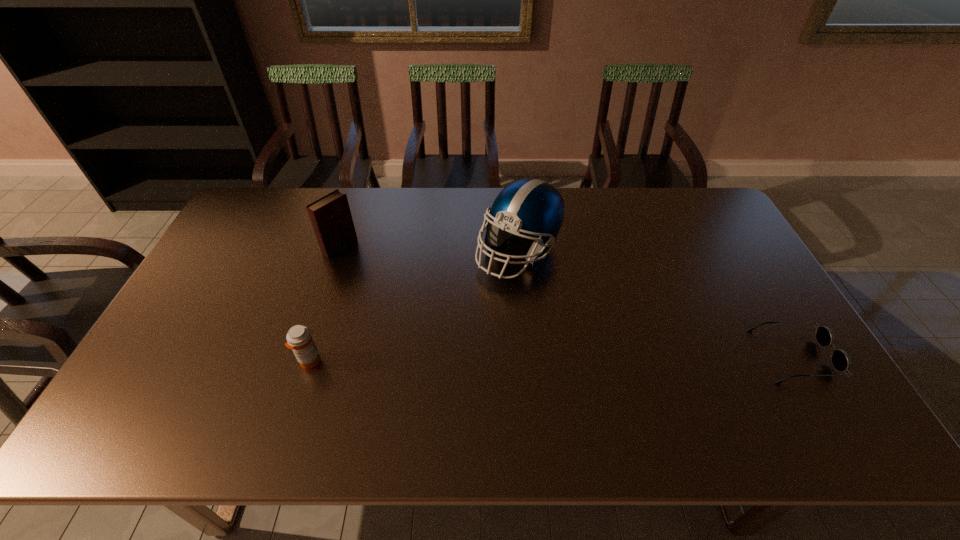
Where is `the second shortest object`? the second shortest object is located at coordinates (299, 339).

The image size is (960, 540). I want to click on the rightmost object, so click(840, 360).

Locate an element on the screen. The image size is (960, 540). sunglasses is located at coordinates (840, 360).

Identify the location of the tallest object. (532, 207).

This screenshot has height=540, width=960. Identify the location of football helmet. (532, 207).

Locate an element on the screen. The height and width of the screenshot is (540, 960). the third shortest object is located at coordinates (330, 216).

Image resolution: width=960 pixels, height=540 pixels. What are the coordinates of `free location located 0.140m on the right of the medicine` in the screenshot? It's located at (375, 361).

Locate an element on the screen. The image size is (960, 540). free location located 0.280m at the front of the second object from right to left with the faceguard is located at coordinates (537, 369).

The width and height of the screenshot is (960, 540). I want to click on vacant space located 0.230m at the front of the second object from right to left with the faceguard, so click(534, 353).

You are a GUI agent. You are given a task and a screenshot of the screen. Output one action in this format:
    pyautogui.click(x=<x>, y=<y>)
    Task: Click on the vacant area located 0.070m at the front of the second object from right to left with the faceguard
    Image resolution: width=960 pixels, height=540 pixels.
    Given the screenshot: What is the action you would take?
    [527, 306]